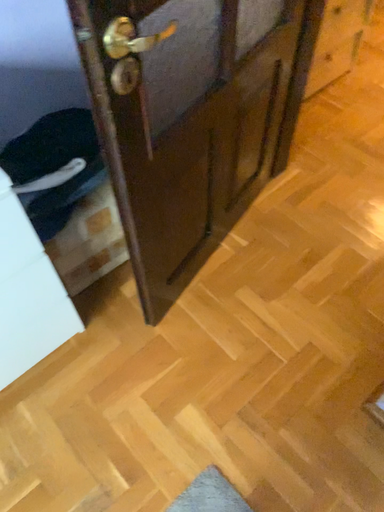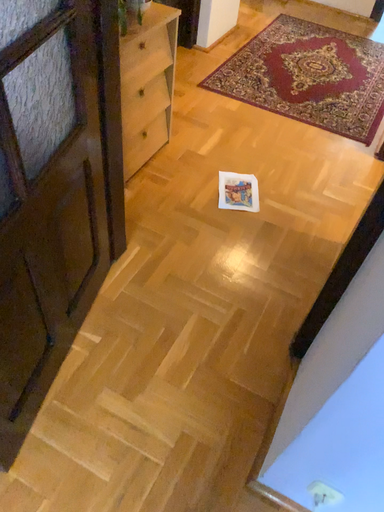
Question: Which way did the camera rotate in the video?

Choices:
 (A) rotated upward
 (B) rotated downward

Answer: (A)